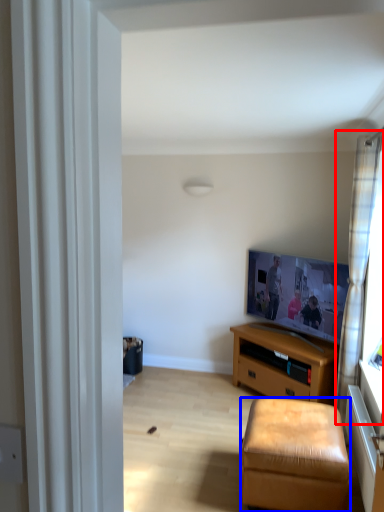
Question: Which point is further to the camera, curtain (highlighted by a red box) or stool (highlighted by a blue box)?

Choices:
 (A) curtain
 (B) stool

Answer: (A)